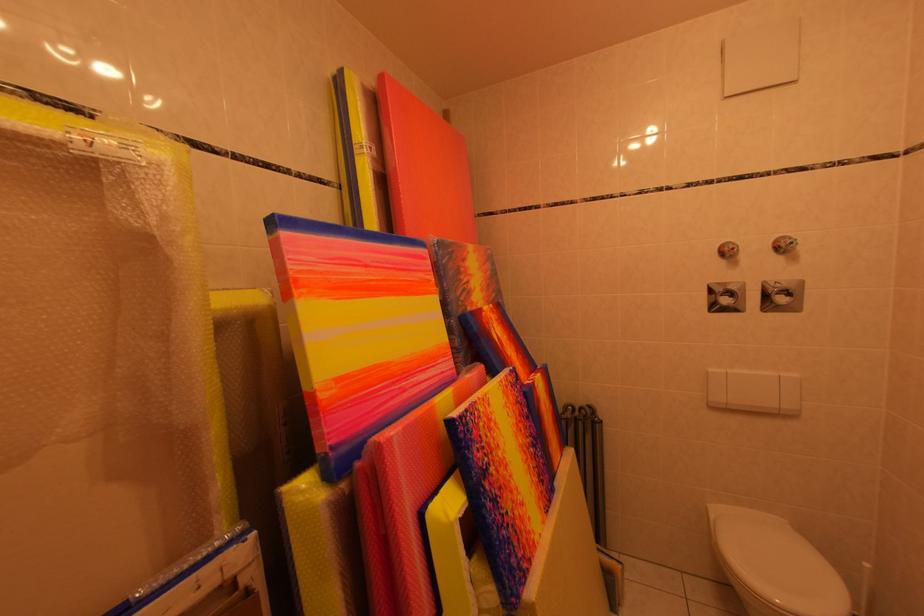
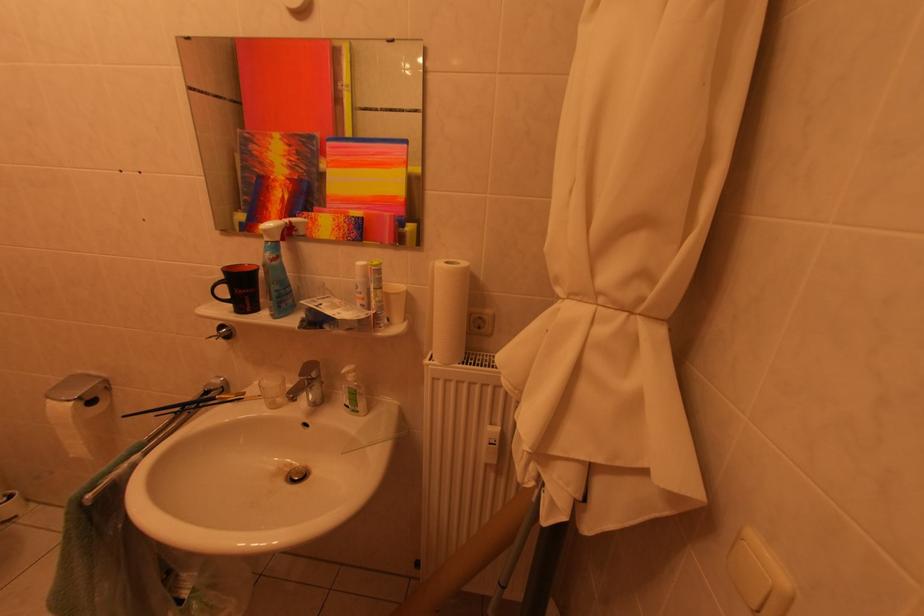
In the scene shown: The images are taken continuously from a first-person perspective. In which direction is your viewpoint rotating?

The camera's rotation is toward right-down.